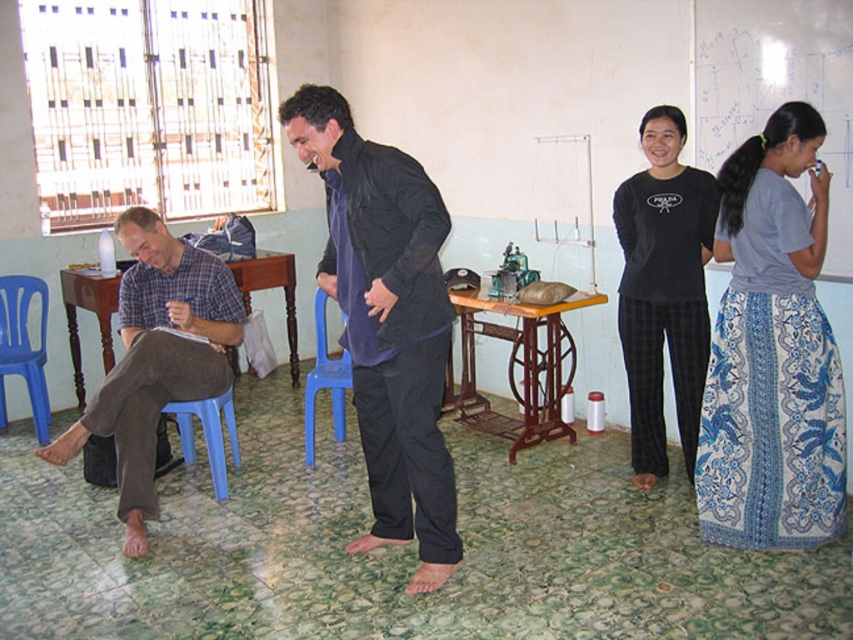
You are a person standing in the room and want to reach the blue plastic chair at left without moving any objects. Which direction should you walk to avoid the blue printed skirt at right?

The blue printed skirt at right is in front of the blue plastic chair at left, so you should walk around to the side of the blue plastic chair at left to avoid the skirt.

You are a visitor in the room and want to sit down. You see the blue printed skirt at right and the blue plastic chair at left. Which one is taller and thus more suitable for sitting?

The blue printed skirt at right is taller than the blue plastic chair at left, so it is more suitable for sitting.